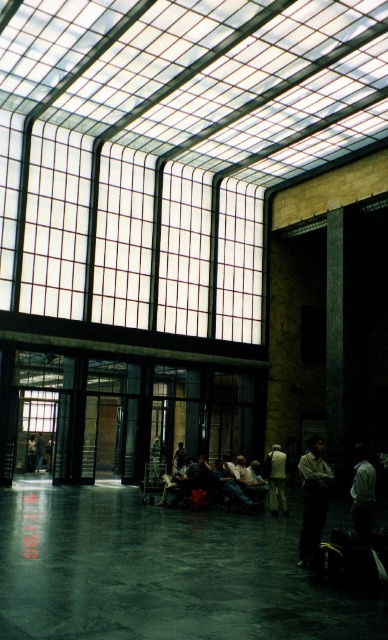
Question: Which point is farther to the camera?

Choices:
 (A) (275, 504)
 (B) (76, 180)
 (C) (313, 464)
 (D) (34, 449)

Answer: (D)

Question: Does clear glass windows at upper center have a larger size compared to white matte shirt at lower right?

Choices:
 (A) yes
 (B) no

Answer: (A)

Question: Which point appears closest to the camera in this image?

Choices:
 (A) (311, 484)
 (B) (39, 444)
 (C) (367, 497)
 (D) (270, 458)

Answer: (A)

Question: Which of the following is the farthest from the observer?

Choices:
 (A) (41, 458)
 (B) (306, 490)

Answer: (A)

Question: Is dark gray pants at center behind dark gray jeans at lower left?

Choices:
 (A) yes
 (B) no

Answer: (B)

Question: Does clear glass windows at upper center have a lesser width compared to white matte shirt at lower right?

Choices:
 (A) no
 (B) yes

Answer: (A)